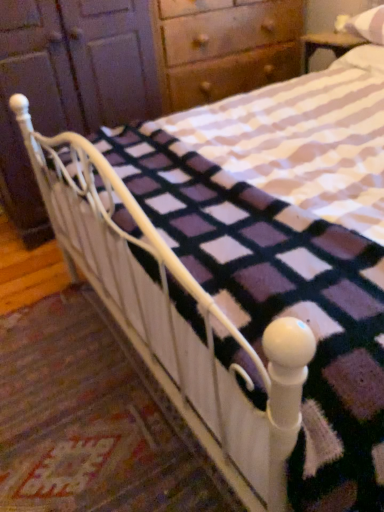
Question: Considering the positions of matte wood dresser at upper left and white cotton pillow at upper right, positioned as the first pillow in bottom-to-top order, in the image, is matte wood dresser at upper left taller or shorter than white cotton pillow at upper right, positioned as the first pillow in bottom-to-top order,?

Choices:
 (A) tall
 (B) short

Answer: (A)

Question: Looking at the image, does matte wood dresser at upper left seem bigger or smaller compared to white cotton pillow at upper right, positioned as the first pillow in bottom-to-top order?

Choices:
 (A) small
 (B) big

Answer: (B)

Question: Which object is the closest to the white soft pillow at upper right, the second pillow when ordered from bottom to top?

Choices:
 (A) matte wood dresser at upper left
 (B) white cotton pillow at upper right, which is the 2th pillow from top to bottom

Answer: (B)

Question: Which is farther from the white cotton pillow at upper right, positioned as the first pillow in bottom-to-top order?

Choices:
 (A) matte wood dresser at upper left
 (B) white soft pillow at upper right, which is counted as the 1th pillow, starting from the top

Answer: (A)